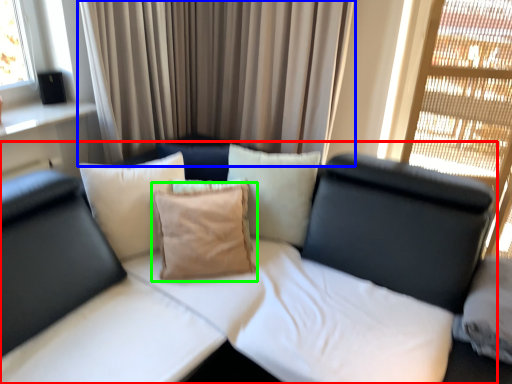
Question: Estimate the real-world distances between objects in this image. Which object is closer to studio couch (highlighted by a red box), curtain (highlighted by a blue box) or pillow (highlighted by a green box)?

Choices:
 (A) curtain
 (B) pillow

Answer: (B)